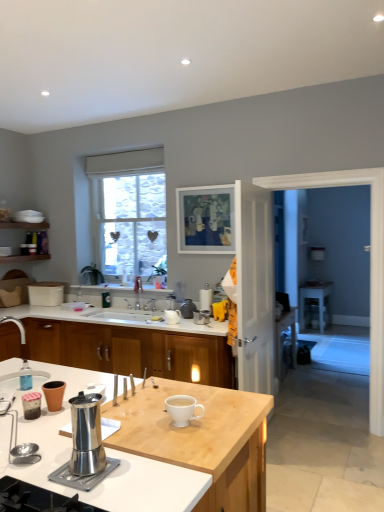
Question: Is white paper towel holder at center, placed as the first appliance when sorted from right to left, surrounded by white ceramic sink at center?

Choices:
 (A) yes
 (B) no

Answer: (B)

Question: Does white ceramic sink at center come behind white paper towel holder at center, which ranks as the 1th appliance in back-to-front order?

Choices:
 (A) yes
 (B) no

Answer: (B)

Question: Does white ceramic sink at center come in front of white paper towel holder at center, placed as the first appliance when sorted from right to left?

Choices:
 (A) no
 (B) yes

Answer: (B)

Question: Is white ceramic sink at center shorter than white paper towel holder at center, which ranks as the 1th appliance in back-to-front order?

Choices:
 (A) no
 (B) yes

Answer: (B)

Question: From a real-world perspective, is white ceramic sink at center on top of white paper towel holder at center, which ranks as the 1th appliance in back-to-front order?

Choices:
 (A) no
 (B) yes

Answer: (A)

Question: Considering the relative positions of white glossy mug at center, the 2th coffee cup from the back, and polished stainless steel coffee maker at lower left, which appears as the 1th appliance when viewed from the left, in the image provided, is white glossy mug at center, the 2th coffee cup from the back, to the left or to the right of polished stainless steel coffee maker at lower left, which appears as the 1th appliance when viewed from the left,?

Choices:
 (A) right
 (B) left

Answer: (A)

Question: Considering the positions of white glossy mug at center, placed as the 1th coffee cup when sorted from front to back, and polished stainless steel coffee maker at lower left, acting as the 2th appliance starting from the back, in the image, is white glossy mug at center, placed as the 1th coffee cup when sorted from front to back, taller or shorter than polished stainless steel coffee maker at lower left, acting as the 2th appliance starting from the back,?

Choices:
 (A) tall
 (B) short

Answer: (B)

Question: From a real-world perspective, is white glossy mug at center, the 2th coffee cup in the left-to-right sequence, positioned above or below polished stainless steel coffee maker at lower left, which appears as the second appliance when viewed from the right?

Choices:
 (A) above
 (B) below

Answer: (B)

Question: Is white glossy mug at center, the 2th coffee cup in the left-to-right sequence, wider or thinner than polished stainless steel coffee maker at lower left, which appears as the 1th appliance when viewed from the left?

Choices:
 (A) wide
 (B) thin

Answer: (A)

Question: In terms of height, does light wood countertop at center, the 2th countertop from the back, look taller or shorter compared to white ceramic sink at center?

Choices:
 (A) short
 (B) tall

Answer: (B)

Question: Is light wood countertop at center, the 2th countertop from the back, bigger or smaller than white ceramic sink at center?

Choices:
 (A) small
 (B) big

Answer: (B)

Question: Based on their positions, is light wood countertop at center, placed as the 1th countertop when sorted from front to back, located to the left or right of white ceramic sink at center?

Choices:
 (A) left
 (B) right

Answer: (B)

Question: From a real-world perspective, is light wood countertop at center, placed as the 1th countertop when sorted from front to back, above or below white ceramic sink at center?

Choices:
 (A) above
 (B) below

Answer: (B)

Question: Considering the positions of white glossy countertop at center, the 2th countertop positioned from the front, and white glossy door at center, positioned as the first screen door in left-to-right order, in the image, is white glossy countertop at center, the 2th countertop positioned from the front, taller or shorter than white glossy door at center, positioned as the first screen door in left-to-right order,?

Choices:
 (A) tall
 (B) short

Answer: (B)

Question: From the image's perspective, is white glossy countertop at center, the 2th countertop positioned from the front, above or below white glossy door at center, which is counted as the second screen door, starting from the right?

Choices:
 (A) above
 (B) below

Answer: (B)